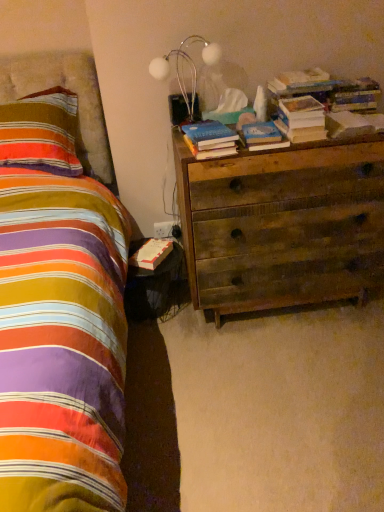
This screenshot has height=512, width=384. I want to click on free space on the front side of wooden chest of drawers at right, so [278, 388].